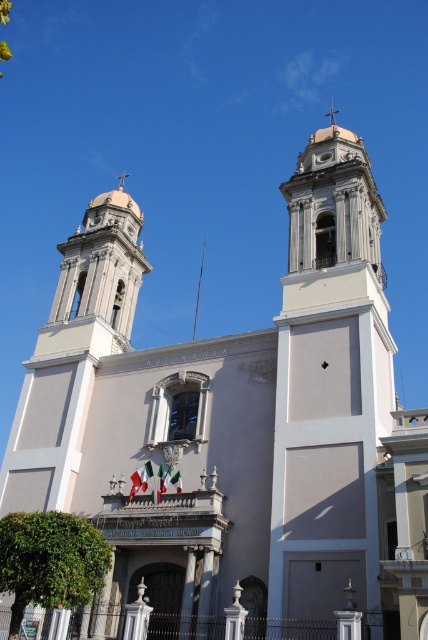
You are standing in front of the grand church and want to take a photo. You notice two points marked in the scene. Which point, point (x=339, y=448) or point (x=53, y=296), is closer to you?

Point (x=339, y=448) is closer to the viewer than point (x=53, y=296).

You are standing in front of the church and want to take a photo of both the white marble bell tower at upper center and the matte white bell tower at upper left. Which bell tower will appear larger in your photo?

The white marble bell tower at upper center will appear larger in the photo because it is closer to the viewer than the matte white bell tower at upper left.